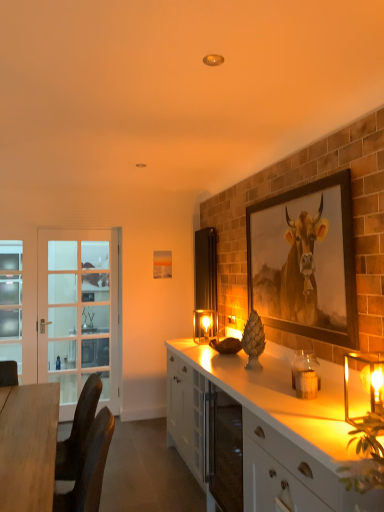
Question: Considering the positions of white glossy cabinet at lower right, the second cabinetry when ordered from back to front, and translucent glass candle at right, acting as the 2th candle holder starting from the front, in the image, is white glossy cabinet at lower right, the second cabinetry when ordered from back to front, bigger or smaller than translucent glass candle at right, acting as the 2th candle holder starting from the front,?

Choices:
 (A) small
 (B) big

Answer: (B)

Question: From a real-world perspective, is white glossy cabinet at lower right, the second cabinetry when ordered from back to front, physically located above or below translucent glass candle at right, arranged as the 2th candle holder when viewed from the left?

Choices:
 (A) above
 (B) below

Answer: (B)

Question: Estimate the real-world distances between objects in this image. Which object is farther from the translucent glass candle at right, the 2th candle holder in the back-to-front sequence?

Choices:
 (A) light blue frosted glass screen door at left, positioned as the first screen door in left-to-right order
 (B) matte glass candle holder at center, which is the first candle holder in left-to-right order
 (C) white glossy cabinet at center, the 2th cabinetry from the front
 (D) translucent glass candle holder at right, the third candle holder in the left-to-right sequence
 (E) white glass screen door at left, arranged as the 1th screen door when viewed from the right

Answer: (A)

Question: Which object is the farthest from the white glossy cabinet at lower right, the second cabinetry when ordered from back to front?

Choices:
 (A) matte glass candle holder at center, which is counted as the third candle holder, starting from the right
 (B) white glass screen door at left, arranged as the 1th screen door when viewed from the right
 (C) wooden desk at left
 (D) white glossy cabinet at center, the 2th cabinetry from the front
 (E) translucent glass candle at right, the 2th candle holder in the back-to-front sequence

Answer: (B)